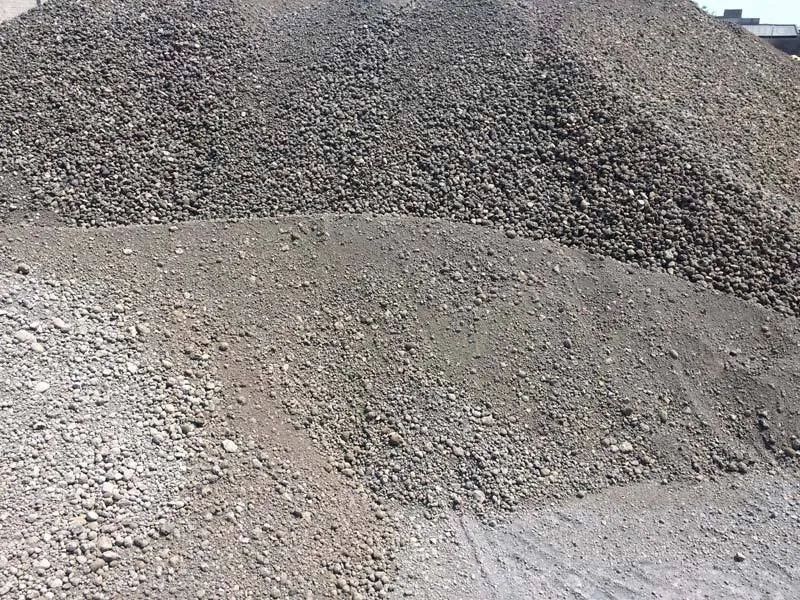
Identify the location of corners. (784, 587), (14, 587), (20, 40), (780, 15).